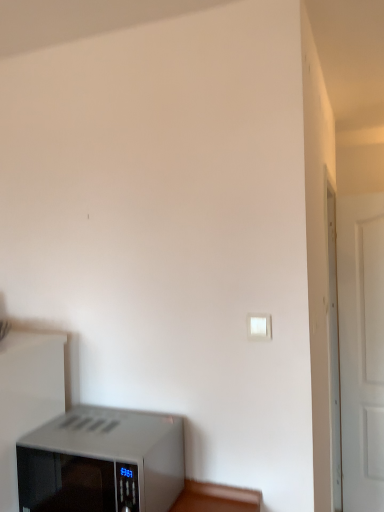
What is the approximate width of satin silver microwave at lower left?

satin silver microwave at lower left is 37.25 centimeters wide.

What do you see at coordinates (361, 357) in the screenshot? I see `white matte door at right` at bounding box center [361, 357].

Locate an element on the screen. This screenshot has height=512, width=384. white plastic light switch at upper right is located at coordinates (259, 326).

In terms of size, does white plastic light switch at upper right appear bigger or smaller than white matte door at right?

Clearly, white plastic light switch at upper right is smaller in size than white matte door at right.

The width and height of the screenshot is (384, 512). In order to click on light switch that is on the left side of white matte door at right in this screenshot , I will do `click(259, 326)`.

Which is more to the right, white plastic light switch at upper right or white matte door at right?

white matte door at right is more to the right.

Can you tell me how much satin silver microwave at lower left and white matte door at right differ in facing direction?

satin silver microwave at lower left and white matte door at right are facing 7.9 degrees away from each other.

Find the location of a particular element. door behind the satin silver microwave at lower left is located at coordinates (361, 357).

Is point (86, 494) positioned in front of point (371, 256)?

Yes, point (86, 494) is closer to viewer.

From the picture: Is satin silver microwave at lower left completely or partially outside of white matte door at right?

satin silver microwave at lower left lies outside white matte door at right's area.

How far apart are white plastic light switch at upper right and satin silver microwave at lower left?

A distance of 24.84 inches exists between white plastic light switch at upper right and satin silver microwave at lower left.

Is white plastic light switch at upper right wider than satin silver microwave at lower left?

In fact, white plastic light switch at upper right might be narrower than satin silver microwave at lower left.

Is white plastic light switch at upper right smaller than satin silver microwave at lower left?

Correct, white plastic light switch at upper right occupies less space than satin silver microwave at lower left.

From the picture: Is white plastic light switch at upper right oriented towards satin silver microwave at lower left?

No, white plastic light switch at upper right is not oriented towards satin silver microwave at lower left.

Find the location of `door behind the white plastic light switch at upper right`. door behind the white plastic light switch at upper right is located at coordinates (361, 357).

Does white matte door at right lie in front of white plastic light switch at upper right?

No, it is behind white plastic light switch at upper right.

From a real-world perspective, between white matte door at right and white plastic light switch at upper right, who is vertically higher?

white plastic light switch at upper right is physically above.

Can you confirm if white matte door at right is wider than white plastic light switch at upper right?

Yes, white matte door at right is wider than white plastic light switch at upper right.

Does satin silver microwave at lower left come behind white plastic light switch at upper right?

That is False.

Image resolution: width=384 pixels, height=512 pixels. I want to click on home appliance that appears on the left of white plastic light switch at upper right, so click(102, 462).

Could you tell me if satin silver microwave at lower left is facing white plastic light switch at upper right?

No.

Is satin silver microwave at lower left situated inside white plastic light switch at upper right or outside?

satin silver microwave at lower left is located beyond the bounds of white plastic light switch at upper right.

Is satin silver microwave at lower left completely or partially inside white matte door at right?

No.

In the scene shown: Is white matte door at right at the right side of satin silver microwave at lower left?

Yes, white matte door at right is to the right of satin silver microwave at lower left.

Considering the positions of point (345, 240) and point (133, 414), is point (345, 240) closer or farther from the camera than point (133, 414)?

Point (345, 240) appears to be farther away from the viewer than point (133, 414).

From the image's perspective, is white matte door at right located above or below satin silver microwave at lower left?

Based on their image positions, white matte door at right is located above satin silver microwave at lower left.

In the image, there is a white plastic light switch at upper right. Identify the location of door below it (from a real-world perspective). (361, 357).

The height and width of the screenshot is (512, 384). I want to click on door lying behind the satin silver microwave at lower left, so click(361, 357).

Based on their spatial positions, is white matte door at right or satin silver microwave at lower left closer to white plastic light switch at upper right?

satin silver microwave at lower left lies closer to white plastic light switch at upper right than the other object.

Considering their positions, is white plastic light switch at upper right positioned further to white matte door at right than satin silver microwave at lower left?

satin silver microwave at lower left is positioned further to the anchor white matte door at right.

When comparing their distances from white matte door at right, does satin silver microwave at lower left or white plastic light switch at upper right seem closer?

The object closer to white matte door at right is white plastic light switch at upper right.

Which object lies nearer to the anchor point satin silver microwave at lower left, white plastic light switch at upper right or white matte door at right?

white plastic light switch at upper right.

In the scene shown: Based on their spatial positions, is satin silver microwave at lower left or white matte door at right closer to white plastic light switch at upper right?

satin silver microwave at lower left.

Considering their positions, is white matte door at right positioned closer to satin silver microwave at lower left than white plastic light switch at upper right?

Among the two, white plastic light switch at upper right is located nearer to satin silver microwave at lower left.

In order to click on light switch located between satin silver microwave at lower left and white matte door at right in the depth direction in this screenshot , I will do `click(259, 326)`.